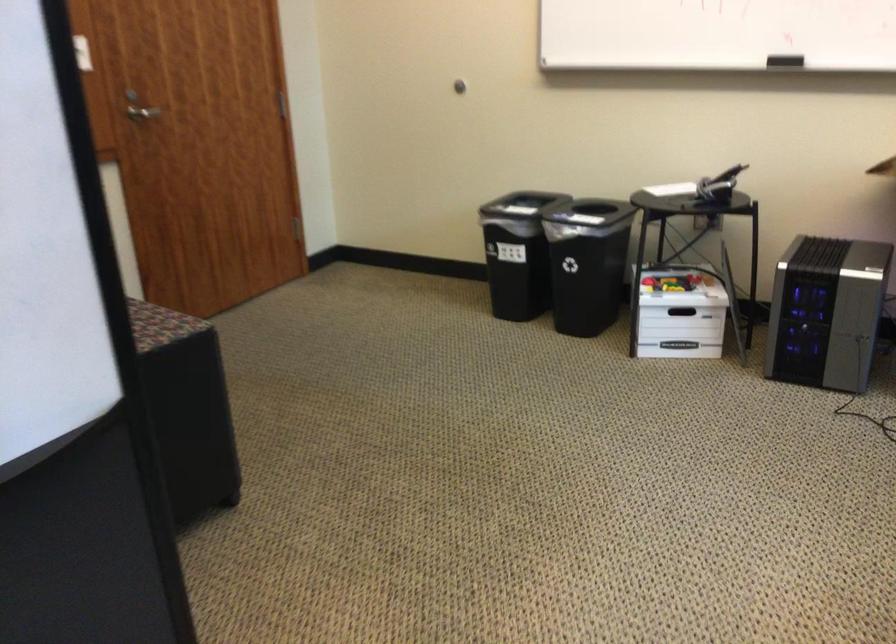
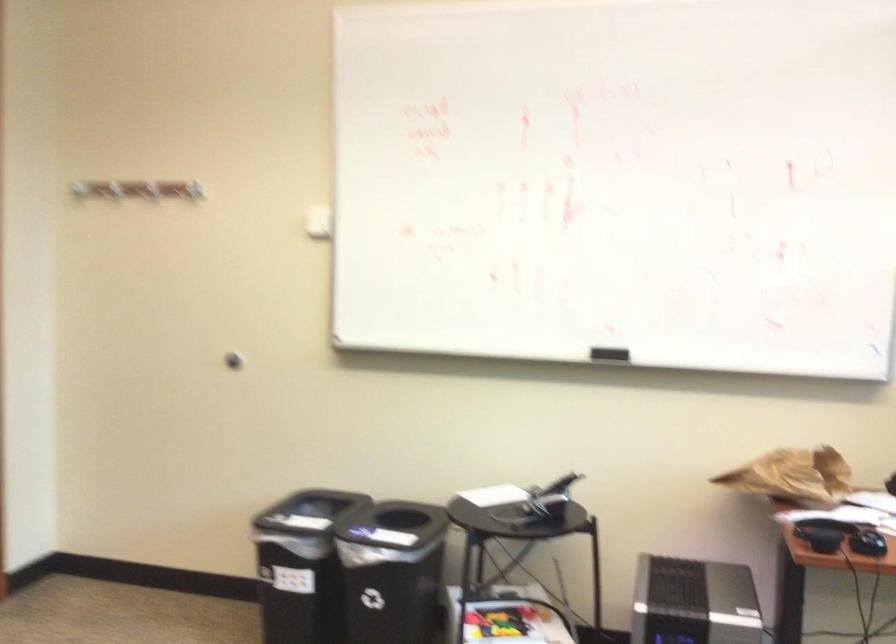
Question: What movement of the cameraman would produce the second image?

Choices:
 (A) Left
 (B) Right
 (C) Forward
 (D) Backward

Answer: (C)